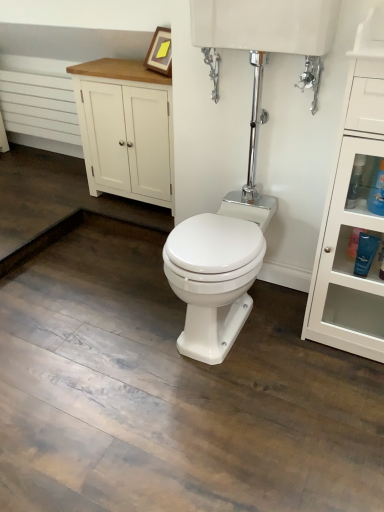
The width and height of the screenshot is (384, 512). In order to click on vacant space in front of white glossy cabinet at right in this screenshot , I will do `click(330, 388)`.